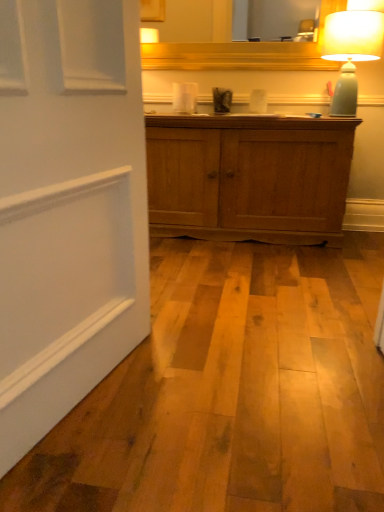
Question: Is wooden mirror at upper center to the left of matte green ceramic lampshade at upper right from the viewer's perspective?

Choices:
 (A) no
 (B) yes

Answer: (B)

Question: From a real-world perspective, does wooden mirror at upper center sit lower than matte green ceramic lampshade at upper right?

Choices:
 (A) yes
 (B) no

Answer: (B)

Question: Does wooden mirror at upper center touch matte green ceramic lampshade at upper right?

Choices:
 (A) no
 (B) yes

Answer: (A)

Question: Does wooden mirror at upper center have a greater width compared to matte green ceramic lampshade at upper right?

Choices:
 (A) yes
 (B) no

Answer: (B)

Question: Is wooden mirror at upper center positioned far away from matte green ceramic lampshade at upper right?

Choices:
 (A) no
 (B) yes

Answer: (A)

Question: Is wooden mirror at upper center at the right side of matte green ceramic lampshade at upper right?

Choices:
 (A) yes
 (B) no

Answer: (B)

Question: From a real-world perspective, is matte green ceramic lampshade at upper right located higher than wooden mirror at upper center?

Choices:
 (A) no
 (B) yes

Answer: (A)

Question: Would you say matte green ceramic lampshade at upper right contains wooden mirror at upper center?

Choices:
 (A) yes
 (B) no

Answer: (B)

Question: From the image's perspective, does matte green ceramic lampshade at upper right appear lower than wooden mirror at upper center?

Choices:
 (A) yes
 (B) no

Answer: (A)

Question: From a real-world perspective, does matte green ceramic lampshade at upper right sit lower than wooden mirror at upper center?

Choices:
 (A) yes
 (B) no

Answer: (A)

Question: From the image's perspective, is matte green ceramic lampshade at upper right on top of wooden mirror at upper center?

Choices:
 (A) yes
 (B) no

Answer: (B)

Question: Is matte green ceramic lampshade at upper right positioned far away from wooden mirror at upper center?

Choices:
 (A) yes
 (B) no

Answer: (B)

Question: Based on their sizes in the image, would you say wooden mirror at upper center is bigger or smaller than matte green ceramic lampshade at upper right?

Choices:
 (A) big
 (B) small

Answer: (B)